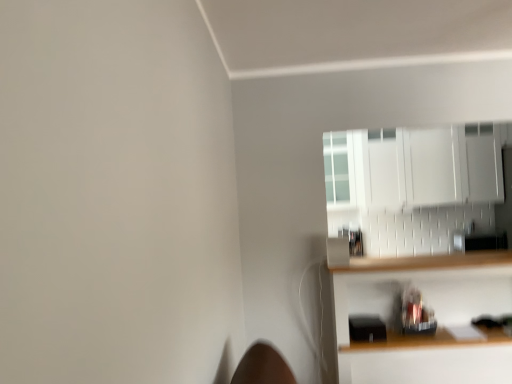
Question: Considering the relative positions of white glossy cabinet at upper right and wooden shelf at lower right in the image provided, is white glossy cabinet at upper right to the left of wooden shelf at lower right from the viewer's perspective?

Choices:
 (A) yes
 (B) no

Answer: (B)

Question: Could you tell me if white glossy cabinet at upper right is facing wooden shelf at lower right?

Choices:
 (A) no
 (B) yes

Answer: (A)

Question: Is white glossy cabinet at upper right smaller than wooden shelf at lower right?

Choices:
 (A) no
 (B) yes

Answer: (B)

Question: Is wooden shelf at lower right at the back of white glossy cabinet at upper right?

Choices:
 (A) no
 (B) yes

Answer: (A)

Question: From a real-world perspective, is white glossy cabinet at upper right positioned under wooden shelf at lower right based on gravity?

Choices:
 (A) yes
 (B) no

Answer: (B)

Question: Does white glossy cabinet at upper right come behind wooden shelf at lower right?

Choices:
 (A) no
 (B) yes

Answer: (B)

Question: Can you confirm if wooden shelf at lower right is shorter than white glossy cabinet at upper right?

Choices:
 (A) yes
 (B) no

Answer: (B)

Question: From a real-world perspective, is wooden shelf at lower right beneath white glossy cabinet at upper right?

Choices:
 (A) yes
 (B) no

Answer: (A)

Question: Is wooden shelf at lower right turned away from white glossy cabinet at upper right?

Choices:
 (A) no
 (B) yes

Answer: (A)

Question: Considering the relative positions of wooden shelf at lower right and white glossy cabinet at upper right in the image provided, is wooden shelf at lower right behind white glossy cabinet at upper right?

Choices:
 (A) no
 (B) yes

Answer: (A)

Question: Can you confirm if wooden shelf at lower right is smaller than white glossy cabinet at upper right?

Choices:
 (A) yes
 (B) no

Answer: (B)

Question: Is wooden shelf at lower right thinner than white glossy cabinet at upper right?

Choices:
 (A) yes
 (B) no

Answer: (B)

Question: Is white glossy cabinet at upper right in front of or behind wooden shelf at lower right in the image?

Choices:
 (A) front
 (B) behind

Answer: (B)